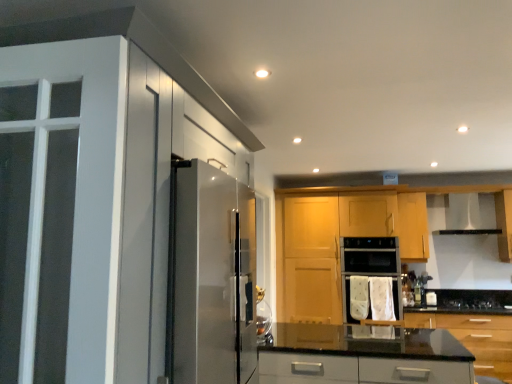
Question: Is black glossy countertop at lower right, which is the 4th cabinetry from left to right, bigger than satin silver screen door at left?

Choices:
 (A) no
 (B) yes

Answer: (B)

Question: Considering the relative sizes of black glossy countertop at lower right, the 1th cabinetry positioned from the right, and satin silver screen door at left in the image provided, is black glossy countertop at lower right, the 1th cabinetry positioned from the right, smaller than satin silver screen door at left?

Choices:
 (A) no
 (B) yes

Answer: (A)

Question: From the image's perspective, is black glossy countertop at lower right, which is the 4th cabinetry from left to right, on satin silver screen door at left?

Choices:
 (A) no
 (B) yes

Answer: (A)

Question: Can you confirm if black glossy countertop at lower right, which is the 4th cabinetry from left to right, is taller than satin silver screen door at left?

Choices:
 (A) yes
 (B) no

Answer: (B)

Question: Considering the relative sizes of black glossy countertop at lower right, which is the 4th cabinetry from left to right, and satin silver screen door at left in the image provided, is black glossy countertop at lower right, which is the 4th cabinetry from left to right, shorter than satin silver screen door at left?

Choices:
 (A) yes
 (B) no

Answer: (A)

Question: Is the position of black glossy countertop at lower right, which is the 4th cabinetry from left to right, less distant than that of satin silver screen door at left?

Choices:
 (A) yes
 (B) no

Answer: (A)

Question: Is black glossy countertop at lower right, the 1th cabinetry positioned from the right, aimed at black glass gas stove at lower center?

Choices:
 (A) yes
 (B) no

Answer: (B)

Question: From the image's perspective, is black glossy countertop at lower right, the 1th cabinetry positioned from the right, located above black glass gas stove at lower center?

Choices:
 (A) no
 (B) yes

Answer: (A)

Question: From a real-world perspective, is black glossy countertop at lower right, the 1th cabinetry positioned from the right, below black glass gas stove at lower center?

Choices:
 (A) no
 (B) yes

Answer: (B)

Question: Is the position of black glossy countertop at lower right, the 1th cabinetry positioned from the right, less distant than that of black glass gas stove at lower center?

Choices:
 (A) no
 (B) yes

Answer: (B)

Question: Is black glossy countertop at lower right, which is the 4th cabinetry from left to right, next to black glass gas stove at lower center?

Choices:
 (A) no
 (B) yes

Answer: (A)

Question: Is black glossy countertop at lower right, the 1th cabinetry positioned from the right, further to the viewer compared to black glass gas stove at lower center?

Choices:
 (A) no
 (B) yes

Answer: (A)

Question: Can you confirm if wooden cabinet at center, which ranks as the third cabinetry in left-to-right order, is thinner than white fabric oven at center?

Choices:
 (A) no
 (B) yes

Answer: (A)